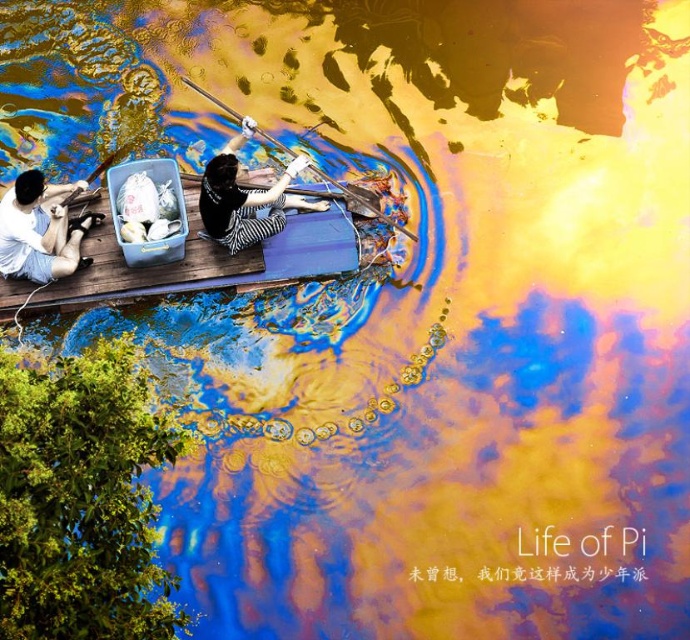
Question: Estimate the real-world distances between objects in this image. Which object is farther from the matte black boat at center?

Choices:
 (A) light blue denim shorts at lower left
 (B) wooden paddle at center
 (C) striped fabric woman at center

Answer: (B)

Question: Is the position of light blue denim shorts at lower left less distant than that of wooden paddle at center?

Choices:
 (A) yes
 (B) no

Answer: (A)

Question: Among these objects, which one is nearest to the camera?

Choices:
 (A) light blue denim shorts at lower left
 (B) wooden paddle at center

Answer: (A)

Question: Which of these objects is positioned closest to the striped fabric woman at center?

Choices:
 (A) wooden paddle at center
 (B) matte black boat at center

Answer: (A)

Question: Is striped fabric woman at center closer to the viewer compared to wooden paddle at center?

Choices:
 (A) no
 (B) yes

Answer: (B)

Question: Can you confirm if light blue denim shorts at lower left is thinner than wooden paddle at center?

Choices:
 (A) no
 (B) yes

Answer: (B)